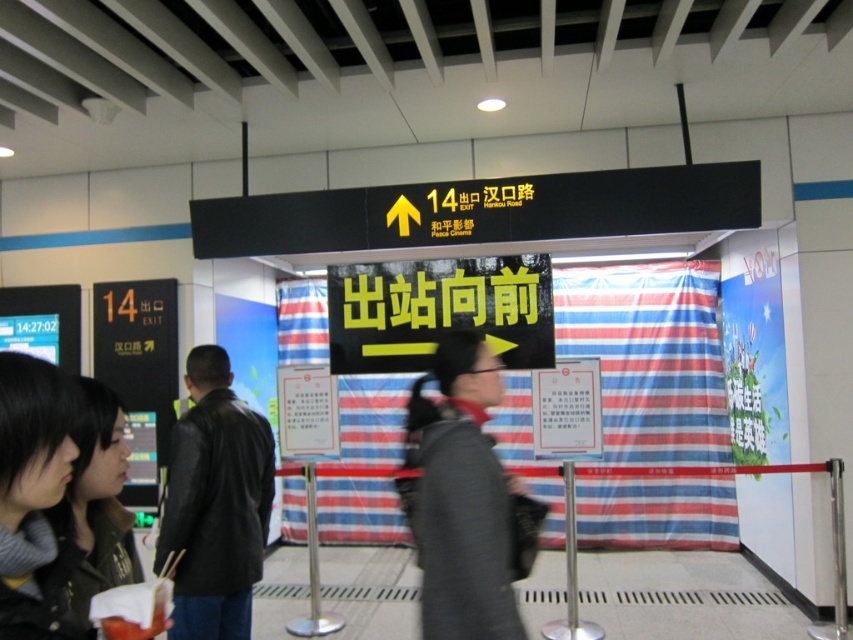
You are standing in the train station and see two people wearing dark gray sweater at lower left and dark brown leather jacket at lower left. Which one is closer to you?

The dark gray sweater at lower left is closer to you because it is in front of the dark brown leather jacket at lower left.

You are standing in the train station and want to take a photo of the signboard above Exit 14. You notice two points marked on the signboard at coordinates point [28,358] and point [102,433]. Which point will appear larger in your camera view?

Point [28,358] is closer to the camera than point [102,433], so it will appear larger in the camera view.